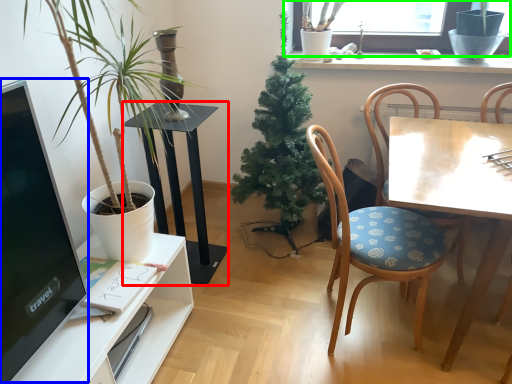
Question: Considering the real-world distances, which object is closest to table (highlighted by a red box)? computer monitor (highlighted by a blue box) or window (highlighted by a green box).

Choices:
 (A) computer monitor
 (B) window

Answer: (A)